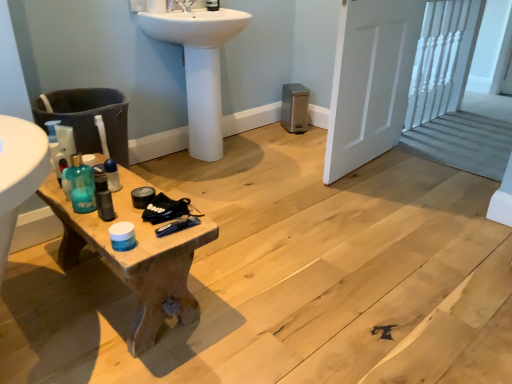
The image size is (512, 384). Find the location of `vacant space in front of white wooden door at right`. vacant space in front of white wooden door at right is located at coordinates (388, 201).